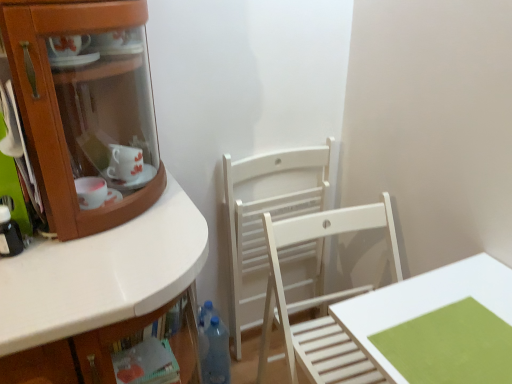
Question: Do you think translucent plastic bottle at left, the second bottle viewed from the back, is within white wooden chair at center, the 1th chair in the front-to-back sequence, or outside of it?

Choices:
 (A) outside
 (B) inside

Answer: (A)

Question: From the image's perspective, is translucent plastic bottle at left, the 2th bottle in the bottom-to-top sequence, located above or below white wooden chair at center, the 2th chair from the back?

Choices:
 (A) below
 (B) above

Answer: (B)

Question: Based on their relative distances, which object is farther from the white matte table at lower right?

Choices:
 (A) translucent plastic bottle at left, the 2th bottle in the right-to-left sequence
 (B) white wooden chair at center, the 2th chair from the back
 (C) white wood chair at center, the second chair from the front
 (D) transparent plastic bottle at lower center, which is counted as the second bottle, starting from the left

Answer: (A)

Question: Which of these objects is positioned closest to the translucent plastic bottle at left, the 2th bottle in the right-to-left sequence?

Choices:
 (A) white wood chair at center, the first chair from the back
 (B) transparent plastic bottle at lower center, positioned as the first bottle in back-to-front order
 (C) white matte table at lower right
 (D) white wooden chair at center, the 2th chair from the back

Answer: (D)